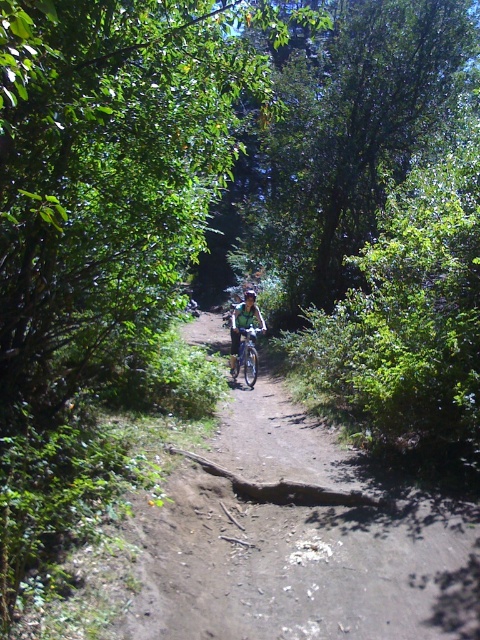
Which of these two, green leafy tree at center or shiny silver mountain bike at center, stands shorter?

Standing shorter between the two is shiny silver mountain bike at center.

Does green leafy tree at center appear under shiny silver mountain bike at center?

Incorrect, green leafy tree at center is not positioned below shiny silver mountain bike at center.

This screenshot has width=480, height=640. Identify the location of green leafy tree at center. (352, 136).

Does dirt path at center have a lesser width compared to green matte bicycle at center?

No.

Between dirt path at center and green matte bicycle at center, which one has less height?

Standing shorter between the two is green matte bicycle at center.

Image resolution: width=480 pixels, height=640 pixels. What are the coordinates of `dirt path at center` in the screenshot? It's located at (298, 540).

Between point (393, 627) and point (252, 336), which one is positioned behind?

The point (252, 336) is more distant.

Is dirt path at center further to the viewer compared to shiny silver mountain bike at center?

No, dirt path at center is closer to the viewer.

Between point (374, 540) and point (244, 355), which one is positioned behind?

The point (244, 355) is more distant.

Identify the location of dirt path at center. The height and width of the screenshot is (640, 480). (298, 540).